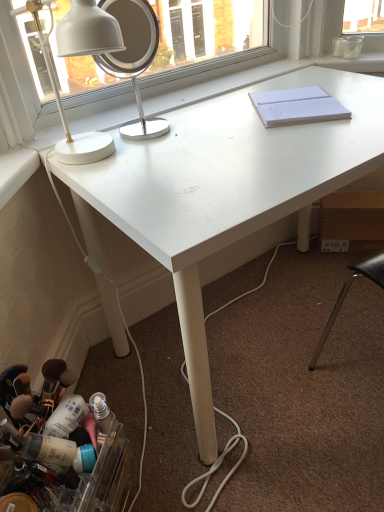
Identify the location of empty space that is to the right of white metallic mirror at upper left. point(205,128).